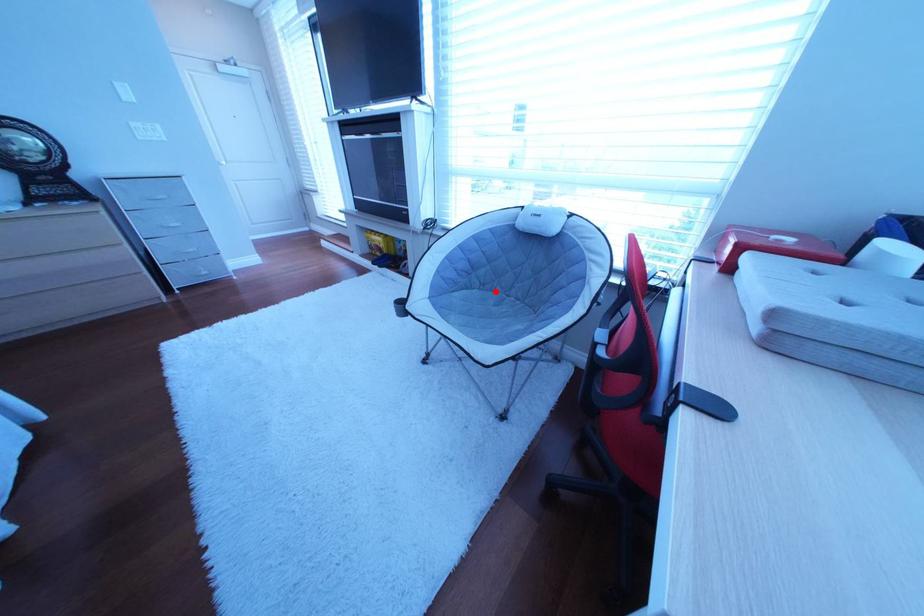
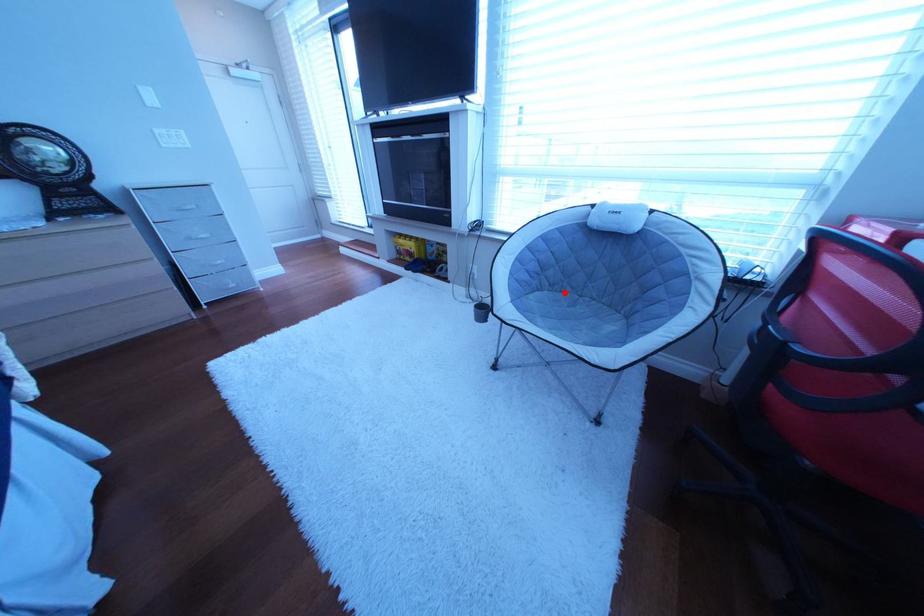
I am providing you with two images of the same scene from different viewpoints. A red point is marked on the first image and another point is marked on the second image. Do the highlighted points in image1 and image2 indicate the same real-world spot?

Yes